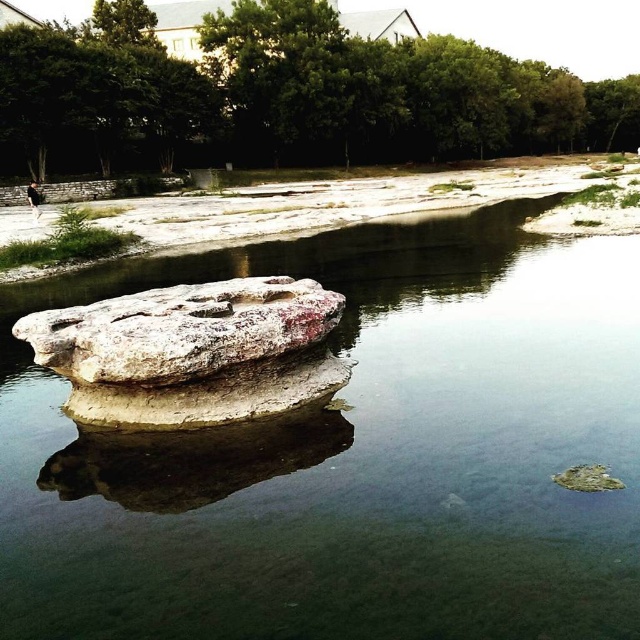
Question: Is clear water at center thinner than green leafy tree at upper center?

Choices:
 (A) no
 (B) yes

Answer: (B)

Question: Is the position of green leafy tree at upper center less distant than that of white rough rock at center?

Choices:
 (A) yes
 (B) no

Answer: (B)

Question: Is clear water at center wider than white rough rock at center?

Choices:
 (A) yes
 (B) no

Answer: (A)

Question: Among these points, which one is farthest from the camera?

Choices:
 (A) (148, 291)
 (B) (605, 92)

Answer: (B)

Question: Which object appears closest to the camera in this image?

Choices:
 (A) white rough rock at center
 (B) clear water at center

Answer: (B)

Question: Which object appears closest to the camera in this image?

Choices:
 (A) white rough rock at center
 (B) clear water at center
 (C) green leafy tree at upper center

Answer: (B)